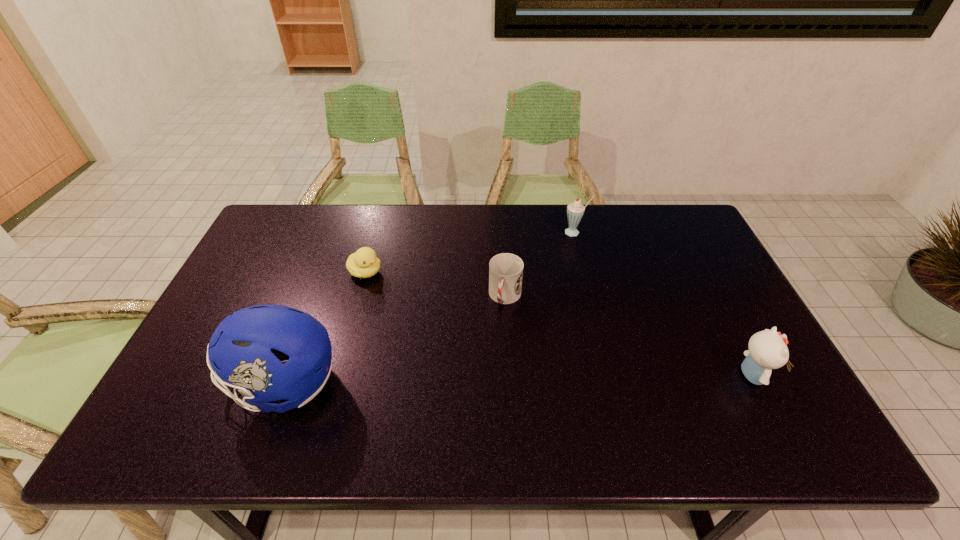
Where is `object present at the right edge`? object present at the right edge is located at coordinates (768, 350).

Locate an element on the screen. object at the near left corner is located at coordinates (246, 349).

Where is `object that is at the near right corner`? object that is at the near right corner is located at coordinates (768, 350).

Where is `vacant area at the far edge of the desktop`? vacant area at the far edge of the desktop is located at coordinates 540,211.

Image resolution: width=960 pixels, height=540 pixels. I want to click on vacant area at the near edge, so click(532, 375).

Locate an element on the screen. The image size is (960, 540). vacant area at the left edge of the desktop is located at coordinates (299, 254).

Locate an element on the screen. This screenshot has height=540, width=960. vacant space at the right edge of the desktop is located at coordinates (707, 333).

At what (x,y) coordinates should I click in order to perform the action: click on free spot between the milkshake and the football helmet. Please return your answer as a coordinate pair (x, y). Image resolution: width=960 pixels, height=540 pixels. Looking at the image, I should click on (429, 308).

Locate an element on the screen. blank region between the cup and the duckling is located at coordinates (435, 285).

Locate an element on the screen. empty space between the second object from right to left and the rightmost object is located at coordinates (663, 303).